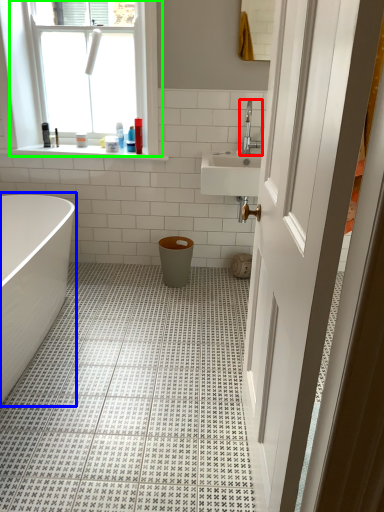
Question: Estimate the real-world distances between objects in this image. Which object is closer to tap (highlighted by a red box), bathtub (highlighted by a blue box) or window (highlighted by a green box)?

Choices:
 (A) bathtub
 (B) window

Answer: (B)